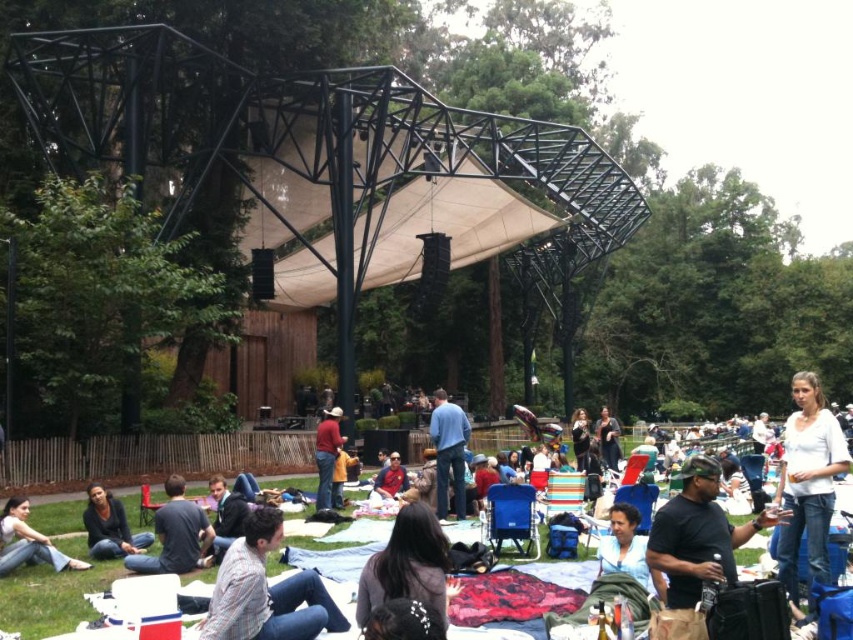
Consider the image. You are at the outdoor concert and want to move from the front of the stage to the back. Which direction should you walk relative to the two points labeled as point (59, 566) and point (614, 467)?

To move from the front of the stage to the back, you should walk away from point (59, 566) and towards point (614, 467) because point (59, 566) is in front of point (614, 467).

You are standing at the origin point of the coordinate system in the image. You want to walk to the white cotton shirt at center. In which direction should you move? Please provide the direction in terms of x and y coordinates. For example, moving towards positive x and positive y direction.

The white cotton shirt at center is located at point 0.867 in x and 0.802 in y coordinates. Since you are at the origin, you should move in the positive x and positive y direction to reach it.

You are standing at the center of the park and want to take a photo of both the point at location (161,508) and the point at (390,490). Which point should you focus on first to ensure both are in the frame?

You should focus on point (161,508) first because it is closer to the camera than point (390,490), ensuring both points are within the frame.